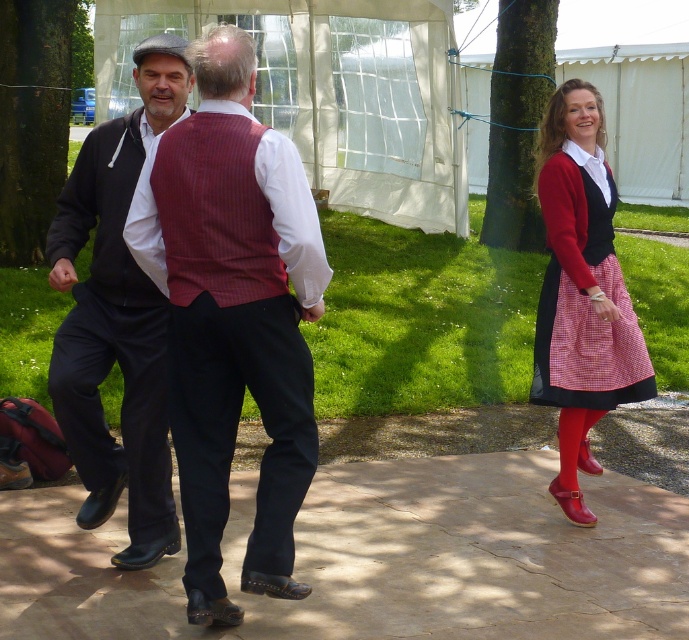
Does point (96, 371) come closer to viewer compared to point (280, 387)?

No, (96, 371) is further to viewer.

Can you confirm if matte black jacket at left is positioned to the left of black smooth pants at center?

Indeed, matte black jacket at left is positioned on the left side of black smooth pants at center.

Based on the photo, who is more forward, (172, 529) or (167, 362)?

Point (167, 362) is more forward.

This screenshot has height=640, width=689. Identify the location of matte black jacket at left. pyautogui.click(x=116, y=317).

Can you confirm if black smooth pants at center is positioned above red checkered skirt at lower right?

No, black smooth pants at center is not above red checkered skirt at lower right.

The height and width of the screenshot is (640, 689). What do you see at coordinates (236, 428) in the screenshot?
I see `black smooth pants at center` at bounding box center [236, 428].

Is point (311, 445) more distant than point (628, 388)?

No, it is in front of (628, 388).

Identify the location of black smooth pants at center. (236, 428).

Measure the distance between brown concrete pavement at lower center and camera.

brown concrete pavement at lower center and camera are 4.75 meters apart.

Who is shorter, brown concrete pavement at lower center or transparent fabric canopy at upper center?

transparent fabric canopy at upper center

Locate an element on the screen. Image resolution: width=689 pixels, height=640 pixels. brown concrete pavement at lower center is located at coordinates (378, 557).